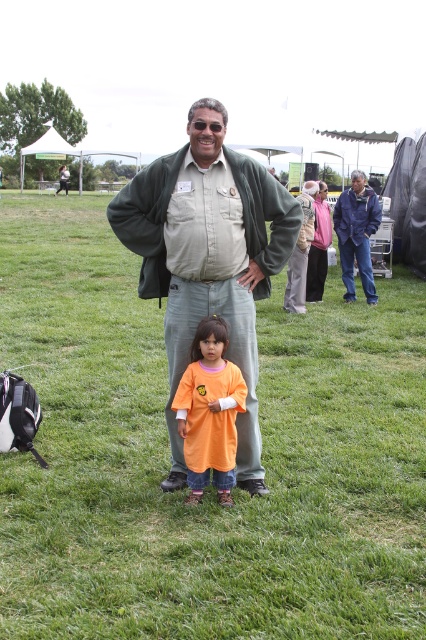
Consider the image. You are standing at the point marked by the coordinates [210,412] in the image. Looking around, you see the orange cotton shirt at center. Which direction should you face to see the orange cotton shirt at center?

Since the orange cotton shirt at center is located exactly at the point [210,412], you are already standing at the same location as the orange cotton shirt at center. Therefore, you would need to look down to see it beneath your feet.

You are a photographer trying to capture a group photo of the people in the scene. You notice a specific point marked at coordinates (207, 259). What object is located at this point?

The point at coordinates (207, 259) marks the matte khaki shirt at center.

You are organizing a group photo and need to arrange two participants wearing the orange cotton shirt at center and blue denim jacket at center. Which clothing item should be placed on the left side if you want the narrower one to be on the left?

The orange cotton shirt at center is narrower than the blue denim jacket at center, so it should be placed on the left side.